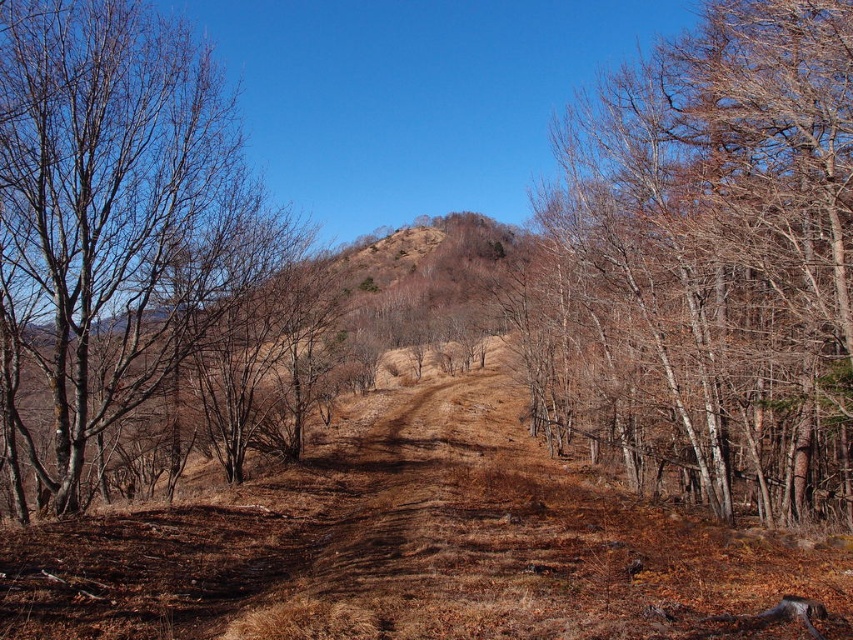
This screenshot has width=853, height=640. What do you see at coordinates (706, 260) in the screenshot?
I see `brown bark tree at right` at bounding box center [706, 260].

Can you confirm if brown bark tree at right is taller than bare branches at left?

Indeed, brown bark tree at right has a greater height compared to bare branches at left.

What do you see at coordinates (706, 260) in the screenshot? I see `brown bark tree at right` at bounding box center [706, 260].

This screenshot has height=640, width=853. What are the coordinates of `brown bark tree at right` in the screenshot? It's located at (706, 260).